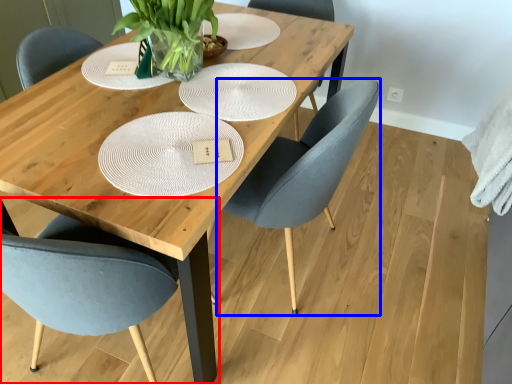
Question: Which of the following is the farthest to the observer, chair (highlighted by a red box) or chair (highlighted by a blue box)?

Choices:
 (A) chair
 (B) chair

Answer: (B)